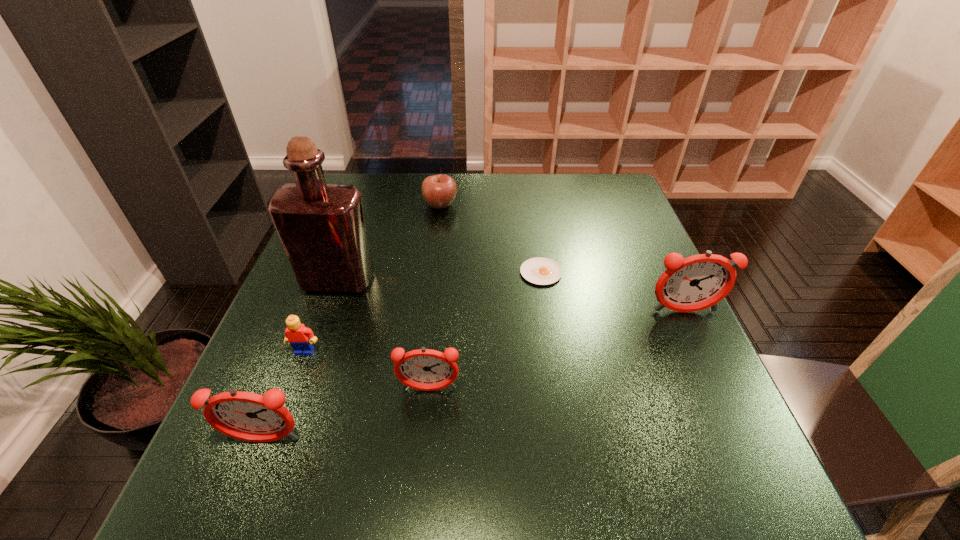
The image size is (960, 540). I want to click on the nearest object, so click(247, 416).

Locate an element on the screen. the nearest alarm clock is located at coordinates (247, 416).

The height and width of the screenshot is (540, 960). Find the location of `the second nearest alarm clock`. the second nearest alarm clock is located at coordinates (424, 369).

Identify the location of the shortest alarm clock. This screenshot has height=540, width=960. (424, 369).

Image resolution: width=960 pixels, height=540 pixels. I want to click on the rightmost alarm clock, so click(x=691, y=284).

Identify the location of the fourth farthest object. The height and width of the screenshot is (540, 960). (691, 284).

Image resolution: width=960 pixels, height=540 pixels. What are the coordinates of `the second shortest object` in the screenshot? It's located at (438, 191).

This screenshot has height=540, width=960. What are the coordinates of `apple` in the screenshot? It's located at click(438, 191).

I want to click on the tallest object, so click(x=321, y=226).

Where is `the shortest object`? the shortest object is located at coordinates (542, 271).